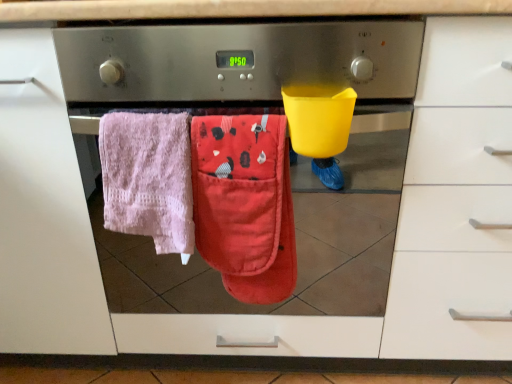
Question: Is red cotton oven mitt at center, placed as the 2th beach towel when sorted from left to right, wider or thinner than pink terry cloth towel at left, arranged as the second beach towel when viewed from the right?

Choices:
 (A) thin
 (B) wide

Answer: (A)

Question: Considering the positions of point (270, 210) and point (129, 210), is point (270, 210) closer or farther from the camera than point (129, 210)?

Choices:
 (A) farther
 (B) closer

Answer: (B)

Question: Do you think red cotton oven mitt at center, placed as the 2th beach towel when sorted from left to right, is within pink terry cloth towel at left, arranged as the second beach towel when viewed from the right, or outside of it?

Choices:
 (A) outside
 (B) inside

Answer: (A)

Question: Is pink terry cloth towel at left, marked as the 1th beach towel in a left-to-right arrangement, wider or thinner than red cotton oven mitt at center, arranged as the first beach towel when viewed from the right?

Choices:
 (A) wide
 (B) thin

Answer: (A)

Question: Considering the positions of pink terry cloth towel at left, marked as the 1th beach towel in a left-to-right arrangement, and red cotton oven mitt at center, placed as the 2th beach towel when sorted from left to right, in the image, is pink terry cloth towel at left, marked as the 1th beach towel in a left-to-right arrangement, taller or shorter than red cotton oven mitt at center, placed as the 2th beach towel when sorted from left to right,?

Choices:
 (A) tall
 (B) short

Answer: (B)

Question: Considering the relative positions of pink terry cloth towel at left, arranged as the second beach towel when viewed from the right, and red cotton oven mitt at center, arranged as the first beach towel when viewed from the right, in the image provided, is pink terry cloth towel at left, arranged as the second beach towel when viewed from the right, to the left or to the right of red cotton oven mitt at center, arranged as the first beach towel when viewed from the right,?

Choices:
 (A) left
 (B) right

Answer: (A)

Question: From a real-world perspective, is pink terry cloth towel at left, arranged as the second beach towel when viewed from the right, physically located above or below red cotton oven mitt at center, placed as the 2th beach towel when sorted from left to right?

Choices:
 (A) above
 (B) below

Answer: (A)